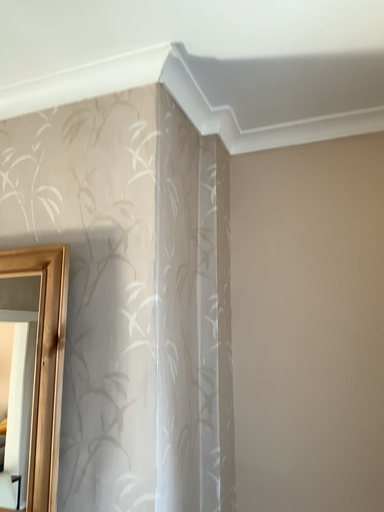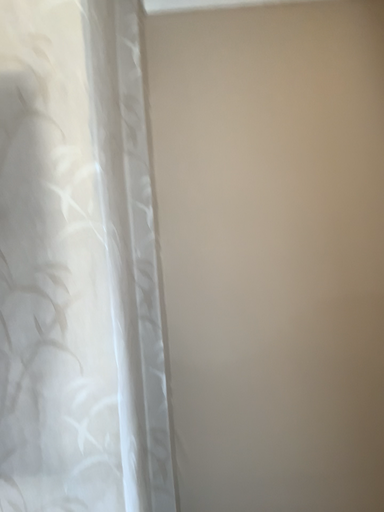
Question: Which way did the camera rotate in the video?

Choices:
 (A) rotated left
 (B) rotated right

Answer: (B)